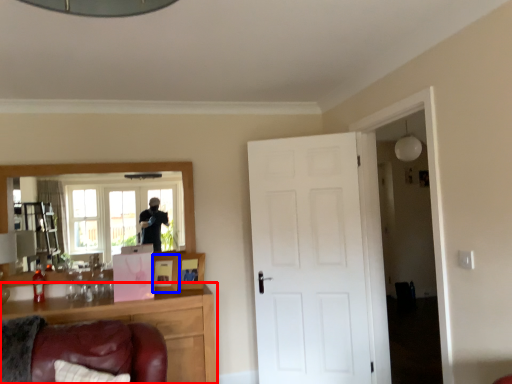
Question: Which object appears farthest to the camera in this image, cabinetry (highlighted by a red box) or picture frame (highlighted by a blue box)?

Choices:
 (A) cabinetry
 (B) picture frame

Answer: (B)